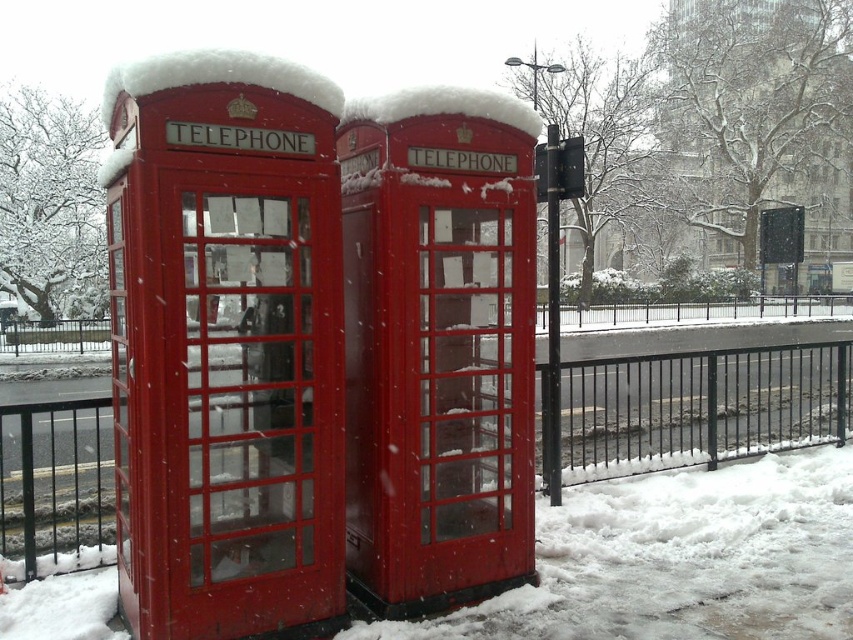
Question: Based on their relative distances, which object is farther from the matte red telephone at left?

Choices:
 (A) metallic black fence at lower center
 (B) matte red telephone booth at center

Answer: (A)

Question: Can you confirm if matte red telephone at left is positioned to the left of matte red telephone booth at center?

Choices:
 (A) no
 (B) yes

Answer: (B)

Question: Among these objects, which one is nearest to the camera?

Choices:
 (A) metallic black fence at lower center
 (B) matte red telephone at left
 (C) matte red telephone booth at center

Answer: (B)

Question: Which point is closer to the camera?

Choices:
 (A) matte red telephone booth at center
 (B) metallic black fence at lower center

Answer: (A)

Question: Is matte red telephone booth at center below metallic black fence at lower center?

Choices:
 (A) yes
 (B) no

Answer: (B)

Question: Is matte red telephone at left to the left of metallic black fence at lower center from the viewer's perspective?

Choices:
 (A) yes
 (B) no

Answer: (A)